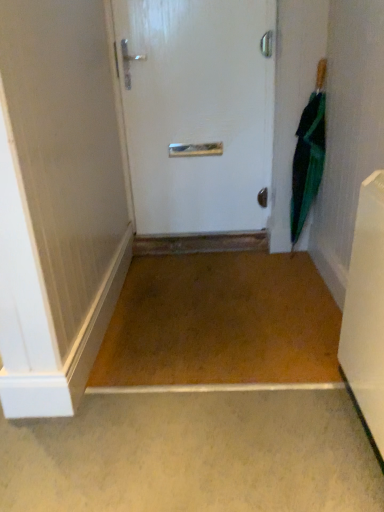
This screenshot has height=512, width=384. I want to click on free space in front of green matte umbrella at right, so click(294, 274).